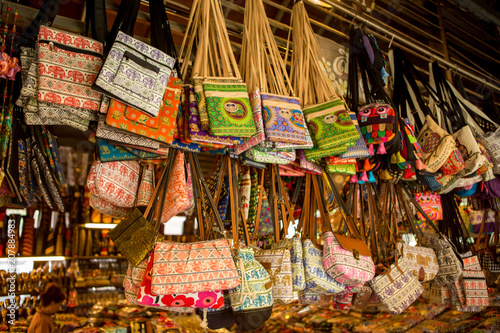
At what (x,y) coordinates should I click in order to perform the action: click on display. Please return your answer as a coordinate pair (x, y). The image size is (500, 333). Looking at the image, I should click on (95, 294), (335, 317), (438, 320), (244, 101).